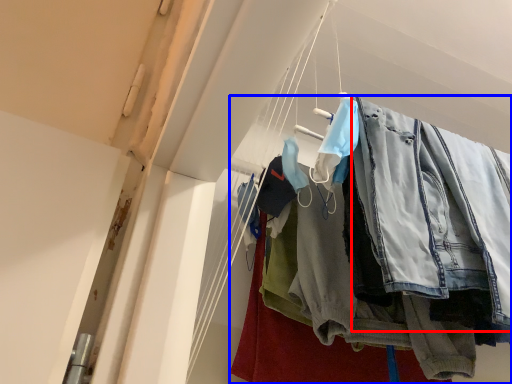
Question: Which of the following is the farthest to the observer, clothing (highlighted by a red box) or trousers (highlighted by a blue box)?

Choices:
 (A) clothing
 (B) trousers

Answer: (B)